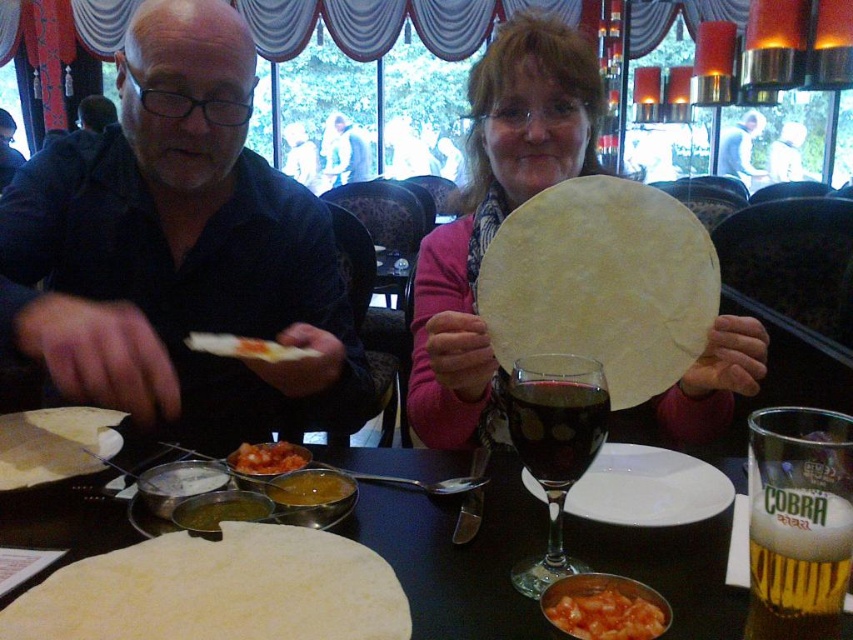
You are a server at the restaurant and need to determine which shirt to use for a promotional photo. The photo requires the larger shirt to be featured. Which one should you choose between the matte black shirt at center and the smooth black shirt at center?

The matte black shirt at center is larger in size than the smooth black shirt at center, so you should choose the matte black shirt at center for the promotional photo.

You are standing at the camera position and want to reach the point at coordinates [596,403] on the table. If your arm can extend 24 inches, can you comfortably reach that point without moving your feet?

The point at coordinates [596,403] is 24.65 inches away from the camera. Since your arm can only extend 24 inches, you cannot comfortably reach it without moving your feet.

You are a server at the restaurant and need to place a new wine glass on the table. The existing transparent glass wine glass at center is already in use. Where should you place the new glass so it doesn not block the light brown leather jacket at upper center?

Place the new transparent glass wine glass at center to the side of the existing one, ensuring it is not in front of the light brown leather jacket at upper center.